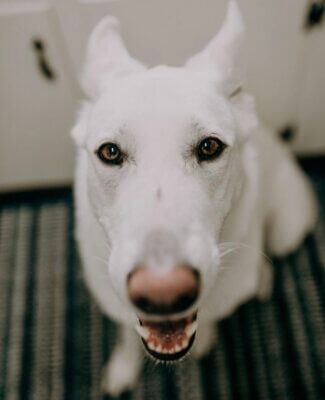
Image resolution: width=325 pixels, height=400 pixels. In order to click on carpet in this screenshot , I will do `click(72, 353)`.